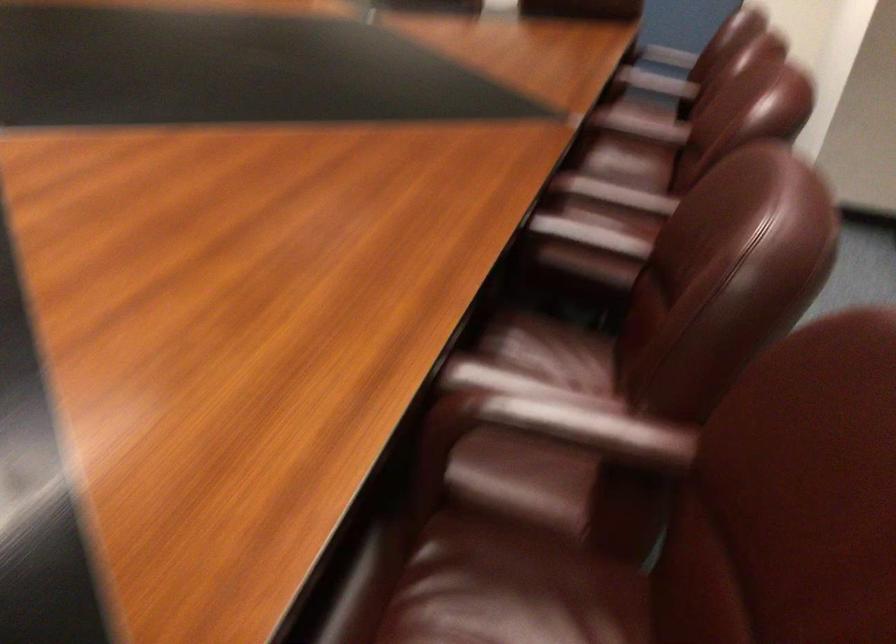
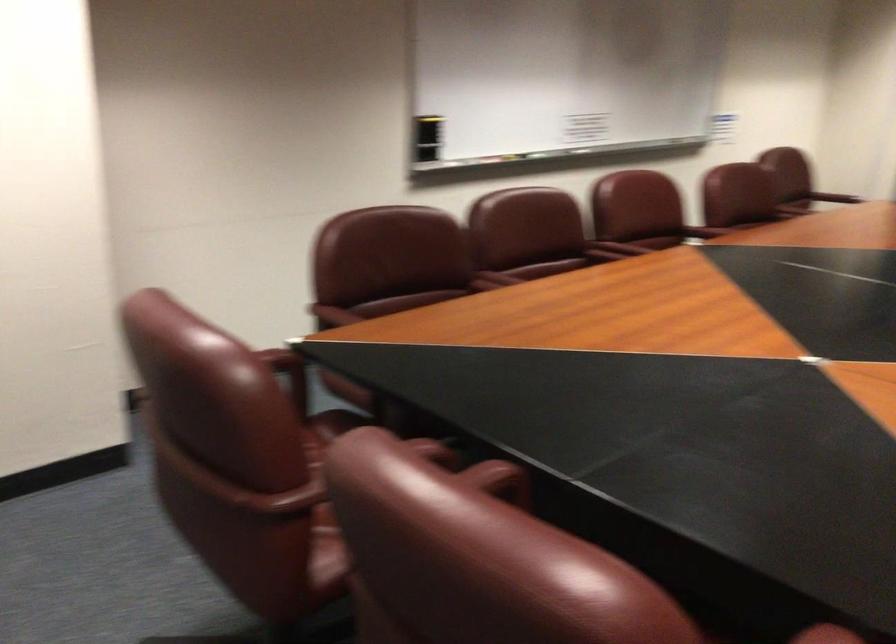
In the second image, find the point that corresponds to point (685, 82) in the first image.

(497, 277)